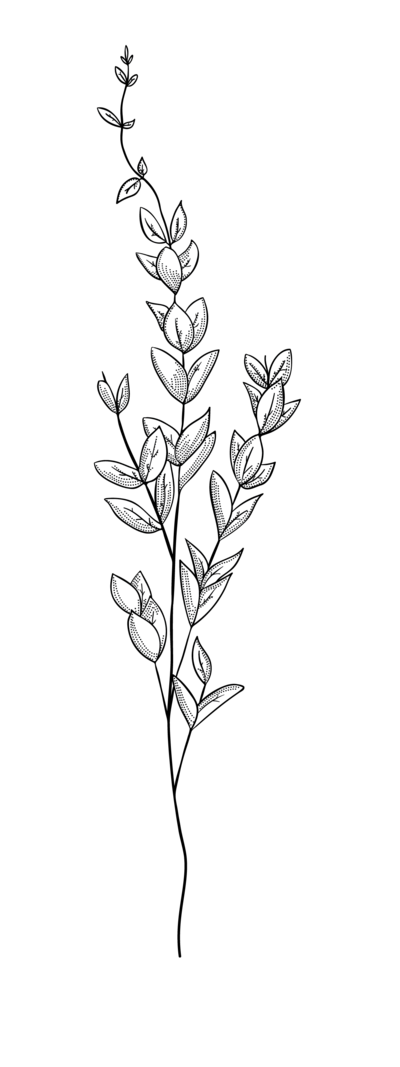
At what (x,y) coordinates should I click in order to perform the action: click on digital picture. Please return your answer as a coordinate pair (x, y). The width and height of the screenshot is (400, 1067). Looking at the image, I should click on (228, 697).